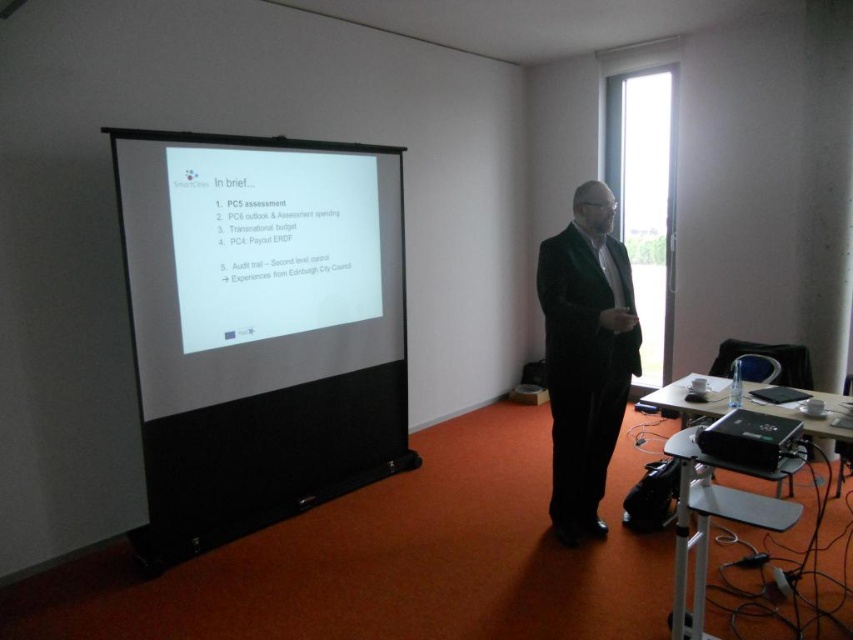
Is white matte projection screen at center bigger than black plastic projector at lower right?

Correct, white matte projection screen at center is larger in size than black plastic projector at lower right.

Which is behind, point (171, 321) or point (737, 442)?

Point (171, 321)

This screenshot has width=853, height=640. What do you see at coordinates (260, 326) in the screenshot? I see `white matte projection screen at center` at bounding box center [260, 326].

At what (x,y) coordinates should I click in order to perform the action: click on white matte projection screen at center. Please return your answer as a coordinate pair (x, y). Looking at the image, I should click on (260, 326).

Is velvet black suit at center wider than black plastic projector at lower right?

Indeed, velvet black suit at center has a greater width compared to black plastic projector at lower right.

This screenshot has width=853, height=640. Describe the element at coordinates (585, 355) in the screenshot. I see `velvet black suit at center` at that location.

This screenshot has width=853, height=640. Find the location of `velvet black suit at center`. velvet black suit at center is located at coordinates (585, 355).

Can you confirm if white matte projection screen at center is bigger than velvet black suit at center?

Correct, white matte projection screen at center is larger in size than velvet black suit at center.

Can you confirm if white matte projection screen at center is taller than velvet black suit at center?

Yes.

The image size is (853, 640). What do you see at coordinates (260, 326) in the screenshot? I see `white matte projection screen at center` at bounding box center [260, 326].

Identify the location of white matte projection screen at center. The image size is (853, 640). (260, 326).